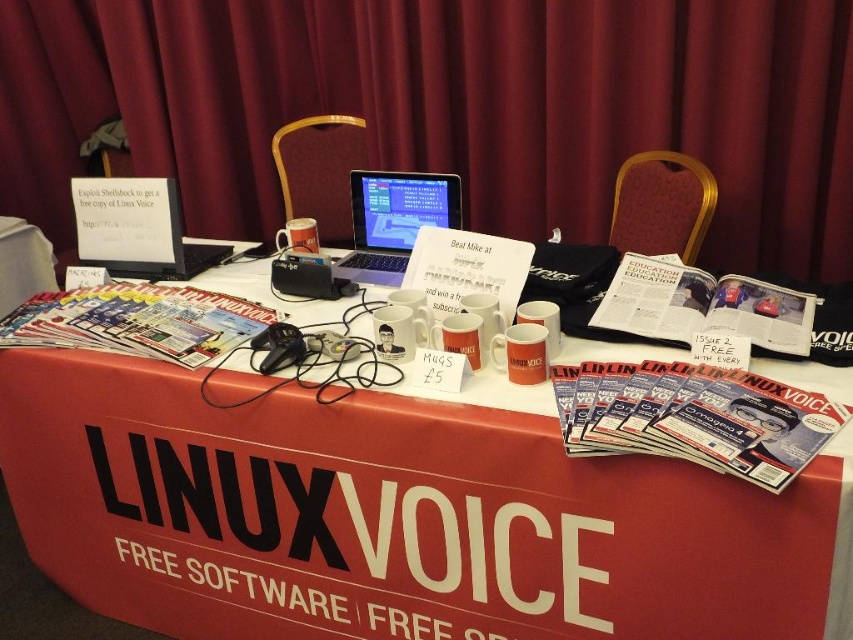
Question: Which object is closer to the camera taking this photo?

Choices:
 (A) maroon fabric curtain at upper center
 (B) black plastic laptop at upper left
 (C) silver metallic laptop at center

Answer: (C)

Question: Which object appears closest to the camera in this image?

Choices:
 (A) maroon fabric curtain at upper center
 (B) silver metallic laptop at center

Answer: (B)

Question: Is white glossy mugs at center closer to the viewer compared to maroon fabric curtain at upper center?

Choices:
 (A) yes
 (B) no

Answer: (A)

Question: Is white glossy mugs at center positioned at the back of black plastic laptop at upper left?

Choices:
 (A) no
 (B) yes

Answer: (A)

Question: Which object is positioned farthest from the white glossy mugs at center?

Choices:
 (A) maroon fabric curtain at upper center
 (B) black plastic laptop at upper left

Answer: (A)

Question: Is white glossy mugs at center smaller than silver metallic laptop at center?

Choices:
 (A) no
 (B) yes

Answer: (A)